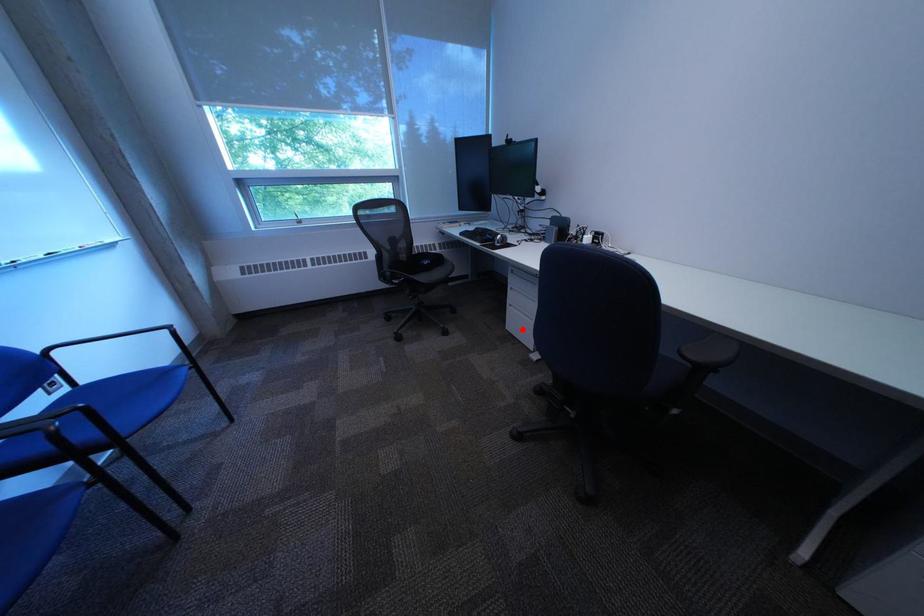
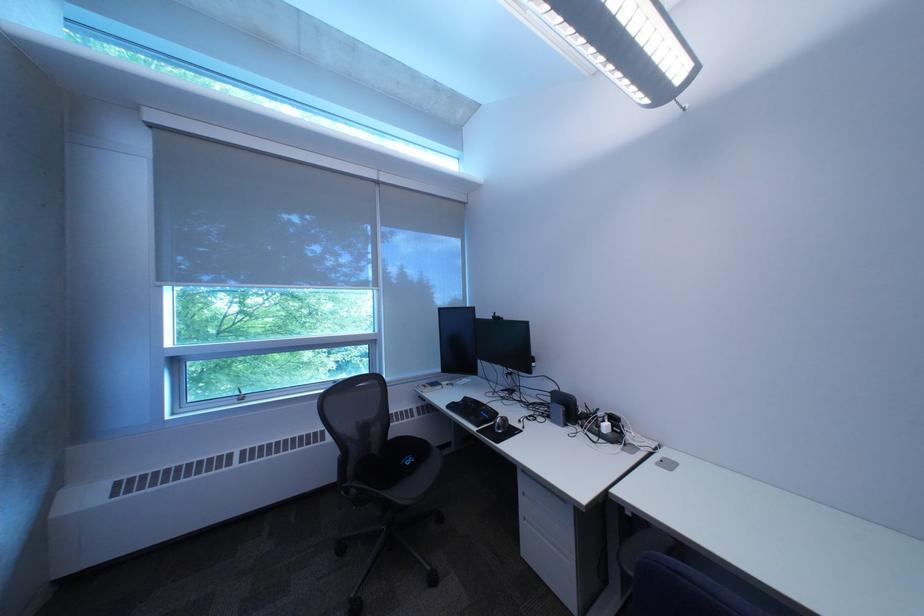
Question: I am providing you with two images of the same scene from different viewpoints. Given a red point in image1, look at the same physical point in image2. Is it:

Choices:
 (A) Closer to the viewpoint
 (B) Farther from the viewpoint

Answer: (B)